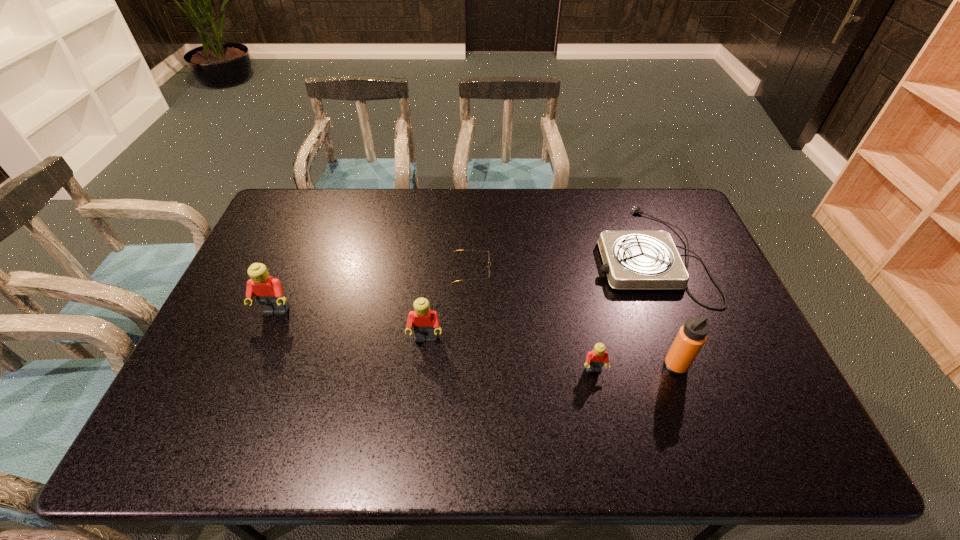
Find the location of a particular element. Image resolution: width=960 pixels, height=540 pixels. free spot that satisfies the following two spatial constraints: 1. on the temples of the spectacles; 2. on the face of the leftmost object is located at coordinates (470, 312).

The height and width of the screenshot is (540, 960). I want to click on vacant space that satisfies the following two spatial constraints: 1. with a retractable cable on the side of the hotplate; 2. on the face of the third nearest object, so click(681, 339).

Where is `vacant point that satisfies the following two spatial constraints: 1. on the temples of the spectacles; 2. on the left side of the thermos bottle`? The width and height of the screenshot is (960, 540). vacant point that satisfies the following two spatial constraints: 1. on the temples of the spectacles; 2. on the left side of the thermos bottle is located at coordinates (469, 366).

Where is `vacant area that satisfies the following two spatial constraints: 1. with a retractable cable on the side of the hotplate; 2. on the face of the leftmost Lego`? The height and width of the screenshot is (540, 960). vacant area that satisfies the following two spatial constraints: 1. with a retractable cable on the side of the hotplate; 2. on the face of the leftmost Lego is located at coordinates (670, 312).

Locate an element on the screen. vacant region that satisfies the following two spatial constraints: 1. on the temples of the spectacles; 2. on the left side of the thermos bottle is located at coordinates (469, 366).

This screenshot has height=540, width=960. What are the coordinates of `vacant space that satisfies the following two spatial constraints: 1. on the temples of the third object from left to right; 2. on the face of the leftmost Lego` in the screenshot? It's located at (470, 312).

At what (x,y) coordinates should I click in order to perform the action: click on vacant area in the image that satisfies the following two spatial constraints: 1. with a retractable cable on the side of the hotplate; 2. on the face of the leftmost object. Please return your answer as a coordinate pair (x, y). Looking at the image, I should click on point(670,312).